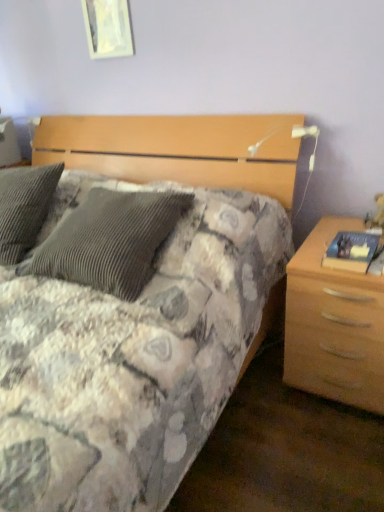
Measure the distance between white glossy picture frame at upper center and camera.

1.87 meters.

Locate an element on the screen. The height and width of the screenshot is (512, 384). white glossy picture frame at upper center is located at coordinates (108, 28).

What do you see at coordinates (108, 28) in the screenshot? I see `white glossy picture frame at upper center` at bounding box center [108, 28].

In order to click on light wood/texture nightstand at right in this screenshot , I will do `click(334, 324)`.

The width and height of the screenshot is (384, 512). Describe the element at coordinates (334, 324) in the screenshot. I see `light wood/texture nightstand at right` at that location.

At what (x,y) coordinates should I click in order to perform the action: click on white glossy picture frame at upper center. Please return your answer as a coordinate pair (x, y). The width and height of the screenshot is (384, 512). Looking at the image, I should click on 108,28.

Considering the relative positions of white glossy picture frame at upper center and light wood/texture nightstand at right in the image provided, is white glossy picture frame at upper center to the right of light wood/texture nightstand at right from the viewer's perspective?

No, white glossy picture frame at upper center is not to the right of light wood/texture nightstand at right.

Does white glossy picture frame at upper center lie in front of light wood/texture nightstand at right?

No.

Which is closer, (94,30) or (313,366)?

Point (94,30) is positioned farther from the camera compared to point (313,366).

From the image's perspective, which object appears higher, white glossy picture frame at upper center or light wood/texture nightstand at right?

From the image's view, white glossy picture frame at upper center is above.

From a real-world perspective, is white glossy picture frame at upper center physically above light wood/texture nightstand at right?

Yes, from a real-world perspective, white glossy picture frame at upper center is above light wood/texture nightstand at right.

Is white glossy picture frame at upper center thinner than light wood/texture nightstand at right?

Correct, the width of white glossy picture frame at upper center is less than that of light wood/texture nightstand at right.

Consider the image. Is white glossy picture frame at upper center taller than light wood/texture nightstand at right?

No, white glossy picture frame at upper center is not taller than light wood/texture nightstand at right.

Can you confirm if white glossy picture frame at upper center is bigger than light wood/texture nightstand at right?

No, white glossy picture frame at upper center is not bigger than light wood/texture nightstand at right.

Is white glossy picture frame at upper center positioned beyond the bounds of light wood/texture nightstand at right?

Yes.

Is white glossy picture frame at upper center directly adjacent to light wood/texture nightstand at right?

No, white glossy picture frame at upper center is not making contact with light wood/texture nightstand at right.

Is light wood/texture nightstand at right at the back of white glossy picture frame at upper center?

white glossy picture frame at upper center is not turned away from light wood/texture nightstand at right.

How much distance is there between white glossy picture frame at upper center and light wood/texture nightstand at right?

The distance of white glossy picture frame at upper center from light wood/texture nightstand at right is 4.84 feet.

I want to click on nightstand below the white glossy picture frame at upper center (from a real-world perspective), so click(x=334, y=324).

Visually, is light wood/texture nightstand at right positioned to the left or to the right of white glossy picture frame at upper center?

In the image, light wood/texture nightstand at right appears on the right side of white glossy picture frame at upper center.

In the image, is light wood/texture nightstand at right positioned in front of or behind white glossy picture frame at upper center?

Clearly, light wood/texture nightstand at right is in front of white glossy picture frame at upper center.

Considering the positions of point (290, 294) and point (129, 48), is point (290, 294) closer or farther from the camera than point (129, 48)?

Point (290, 294) is closer to the camera than point (129, 48).

From the image's perspective, relative to white glossy picture frame at upper center, is light wood/texture nightstand at right above or below?

light wood/texture nightstand at right is below white glossy picture frame at upper center.

From a real-world perspective, is light wood/texture nightstand at right beneath white glossy picture frame at upper center?

Yes, from a real-world perspective, light wood/texture nightstand at right is below white glossy picture frame at upper center.

Which of these two, light wood/texture nightstand at right or white glossy picture frame at upper center, is wider?

light wood/texture nightstand at right is wider.

Considering the relative sizes of light wood/texture nightstand at right and white glossy picture frame at upper center in the image provided, is light wood/texture nightstand at right shorter than white glossy picture frame at upper center?

No.

Does light wood/texture nightstand at right have a larger size compared to white glossy picture frame at upper center?

Correct, light wood/texture nightstand at right is larger in size than white glossy picture frame at upper center.

Could white glossy picture frame at upper center be considered to be inside light wood/texture nightstand at right?

That's incorrect, white glossy picture frame at upper center is not inside light wood/texture nightstand at right.

Is light wood/texture nightstand at right in contact with white glossy picture frame at upper center?

No, light wood/texture nightstand at right is not with white glossy picture frame at upper center.

Could you tell me if light wood/texture nightstand at right is facing white glossy picture frame at upper center?

No, light wood/texture nightstand at right is not aimed at white glossy picture frame at upper center.

How different are the orientations of light wood/texture nightstand at right and white glossy picture frame at upper center in degrees?

0.712 degrees separate the facing orientations of light wood/texture nightstand at right and white glossy picture frame at upper center.

Locate an element on the screen. Image resolution: width=384 pixels, height=512 pixels. picture frame located on the left of light wood/texture nightstand at right is located at coordinates (108, 28).

Locate an element on the screen. nightstand in front of the white glossy picture frame at upper center is located at coordinates (334, 324).

Where is `picture frame that is above the light wood/texture nightstand at right (from the image's perspective)`? Image resolution: width=384 pixels, height=512 pixels. picture frame that is above the light wood/texture nightstand at right (from the image's perspective) is located at coordinates (108, 28).